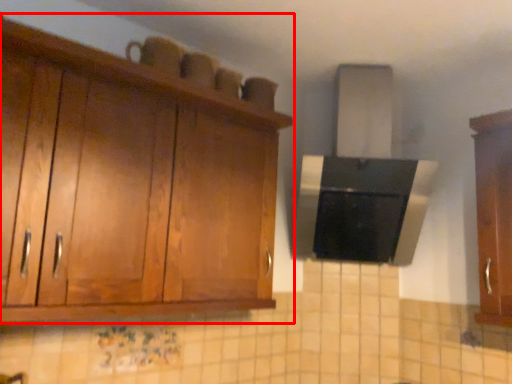
Question: From the image's perspective, what is the correct spatial positioning of cabinetry (annotated by the red box) in reference to cabinetry?

Choices:
 (A) above
 (B) below

Answer: (A)